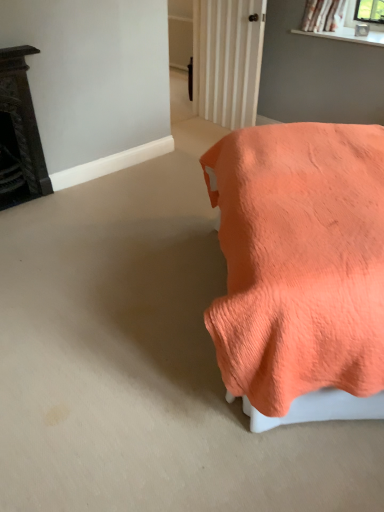
Question: From a real-world perspective, is coral fabric bed at right, the 1th furniture from the right, physically located above or below dark brown ornate fireplace at left, arranged as the 1th furniture when viewed from the left?

Choices:
 (A) above
 (B) below

Answer: (A)

Question: Is point (304, 142) positioned closer to the camera than point (3, 61)?

Choices:
 (A) farther
 (B) closer

Answer: (B)

Question: Is coral fabric bed at right, the 1th furniture from the right, inside or outside of dark brown ornate fireplace at left, arranged as the 1th furniture when viewed from the left?

Choices:
 (A) outside
 (B) inside

Answer: (A)

Question: Is dark brown ornate fireplace at left, arranged as the 1th furniture when viewed from the left, bigger or smaller than coral fabric bed at right, which is the 2th furniture from left to right?

Choices:
 (A) small
 (B) big

Answer: (A)

Question: In the image, is dark brown ornate fireplace at left, arranged as the 1th furniture when viewed from the left, positioned in front of or behind coral fabric bed at right, the 1th furniture from the right?

Choices:
 (A) front
 (B) behind

Answer: (B)

Question: Does point (4, 152) appear closer or farther from the camera than point (304, 240)?

Choices:
 (A) farther
 (B) closer

Answer: (A)

Question: Based on their positions, is dark brown ornate fireplace at left, which is the second furniture from right to left, located to the left or right of coral fabric bed at right, which is the 2th furniture from left to right?

Choices:
 (A) right
 (B) left

Answer: (B)